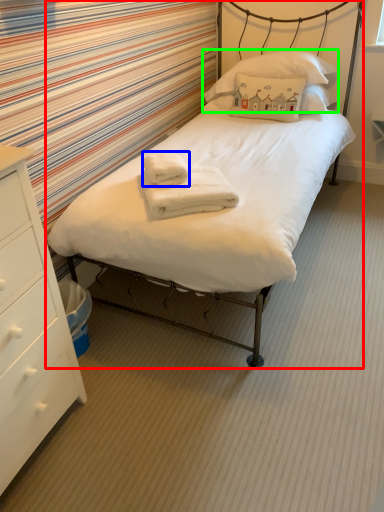
Question: Estimate the real-world distances between objects in this image. Which object is farther from bed (highlighted by a red box), bath towel (highlighted by a blue box) or pillow (highlighted by a green box)?

Choices:
 (A) bath towel
 (B) pillow

Answer: (B)